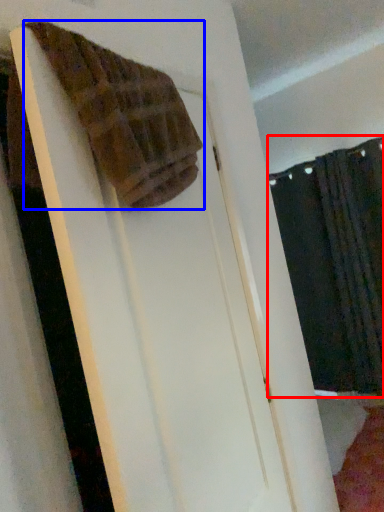
Question: Which point is further to the camera, curtain (highlighted by a red box) or towel (highlighted by a blue box)?

Choices:
 (A) curtain
 (B) towel

Answer: (A)